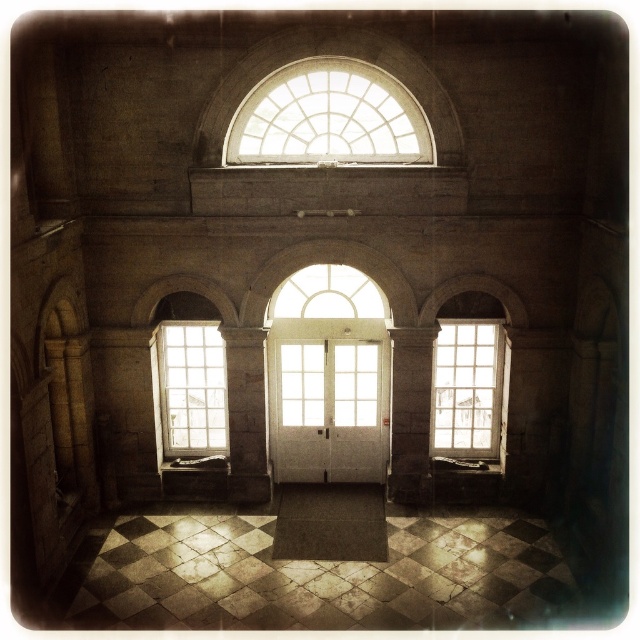
Question: Does clear glass window at right appear on the left side of clear glass window at center?

Choices:
 (A) yes
 (B) no

Answer: (B)

Question: Which object is the farthest from the clear glass window at center left?

Choices:
 (A) clear glass window at center
 (B) clear glass window at right

Answer: (B)

Question: Is clear glass dome at upper center further to the viewer compared to clear glass window at center?

Choices:
 (A) yes
 (B) no

Answer: (B)

Question: Among these objects, which one is nearest to the camera?

Choices:
 (A) clear glass dome at upper center
 (B) clear glass window at center left
 (C) clear glass window at center

Answer: (A)

Question: Among these points, which one is farthest from the camera?

Choices:
 (A) (449, 374)
 (B) (349, 154)
 (C) (308, 298)
 (D) (176, 356)

Answer: (A)

Question: Can you confirm if clear glass window at right is thinner than clear glass window at center?

Choices:
 (A) yes
 (B) no

Answer: (A)